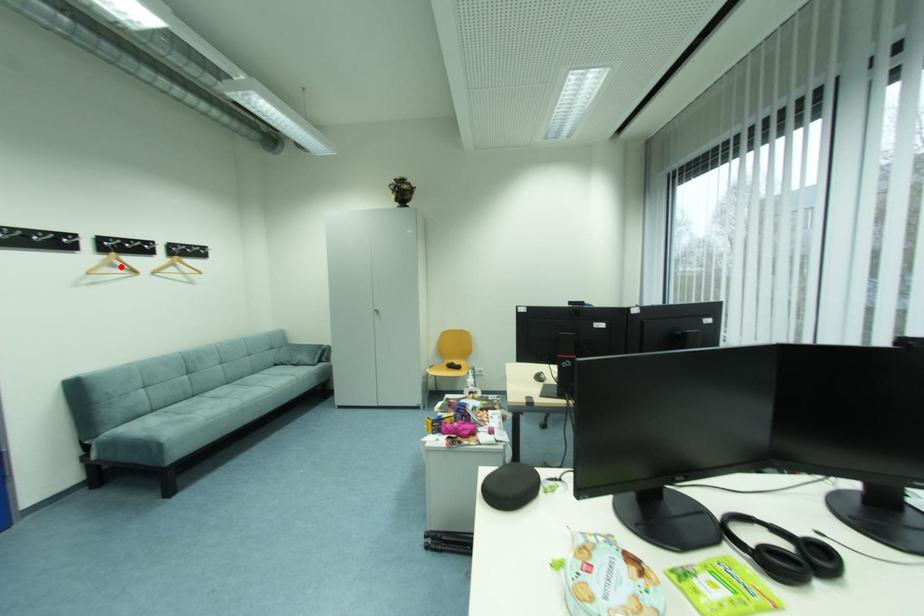
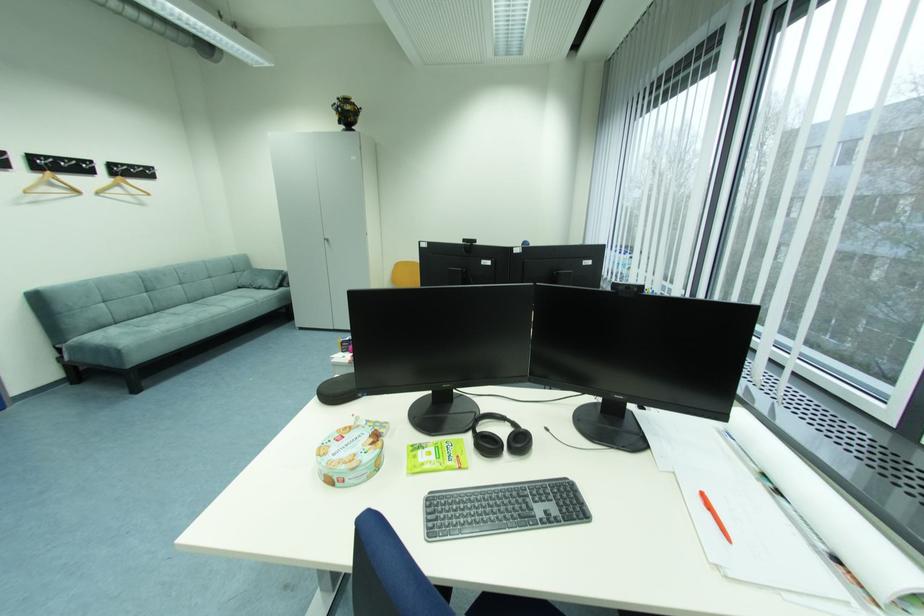
Question: I am providing you with two images of the same scene from different viewpoints. A red point is marked on the first image. Can you still see the location of the red point in image 2?

Choices:
 (A) Yes
 (B) No

Answer: (A)